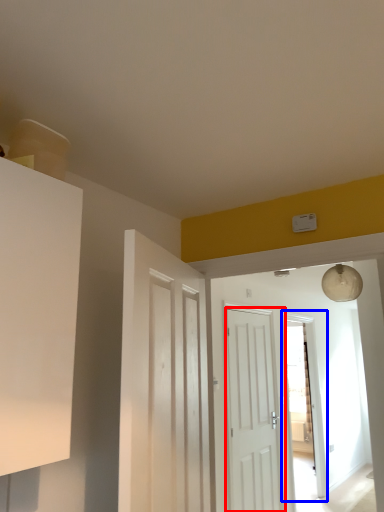
Question: Which point is closer to the camera, door (highlighted by a red box) or glass door (highlighted by a blue box)?

Choices:
 (A) door
 (B) glass door

Answer: (A)